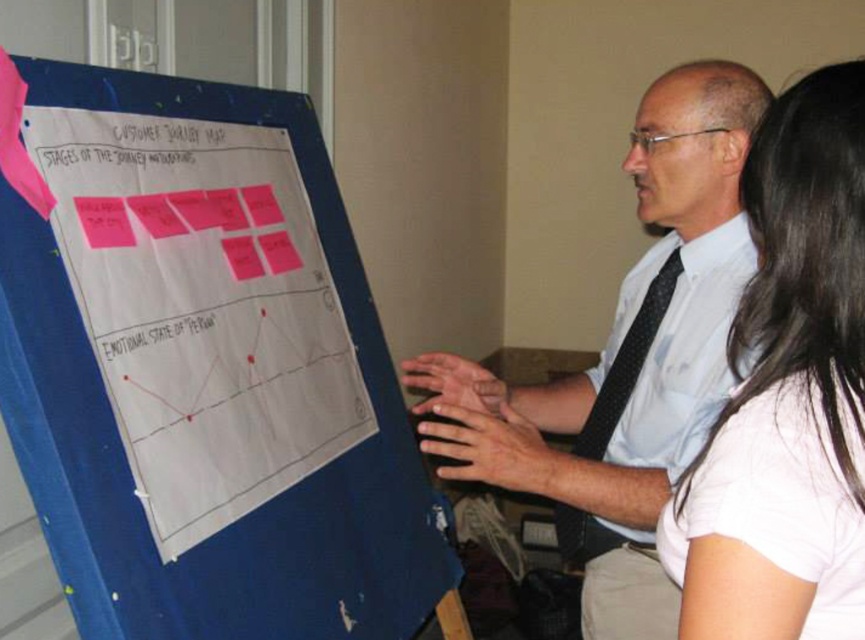
Question: Where is white matte shirt at upper right located in relation to black dotted tie at right in the image?

Choices:
 (A) below
 (B) above

Answer: (B)

Question: Which object is the farthest from the blue fabric bulletin board at left?

Choices:
 (A) white shirt at center
 (B) black dotted tie at right
 (C) white matte shirt at upper right

Answer: (C)

Question: Which point is farther to the camera?

Choices:
 (A) (x=761, y=586)
 (B) (x=157, y=193)
 (C) (x=604, y=403)
 (D) (x=607, y=541)

Answer: (C)

Question: Is white shirt at center above black dotted tie at right?

Choices:
 (A) no
 (B) yes

Answer: (B)

Question: In this image, where is blue fabric bulletin board at left located relative to white shirt at center?

Choices:
 (A) below
 (B) above

Answer: (A)

Question: Which point is farther to the camera?

Choices:
 (A) black dotted tie at right
 (B) white matte shirt at upper right

Answer: (A)